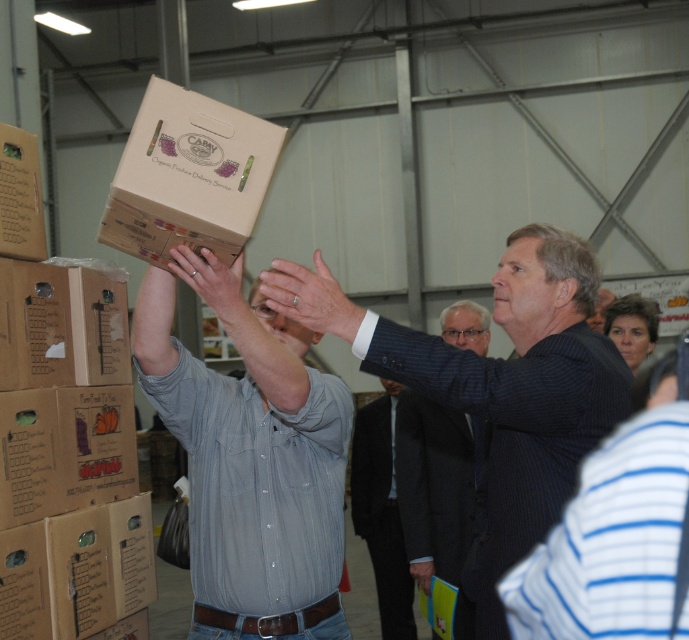
You are an employee in the warehouse and need to determine if the dark blue suit at center can safely step over the matte brown cardboard box at upper left without bending down. Based on their relative heights, can they do this?

The dark blue suit at center is taller than the matte brown cardboard box at upper left, so they can likely step over it without bending down.

You are an observer in the warehouse. You see the denim shirt at upper center and the brown cardboard box at upper center. Which object is taller?

The denim shirt at upper center is taller than the brown cardboard box at upper center.